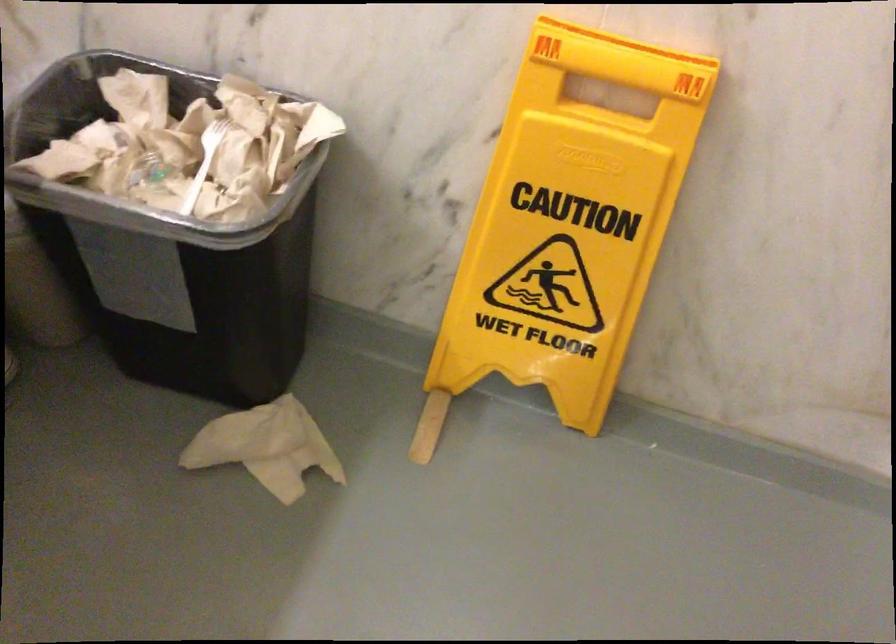
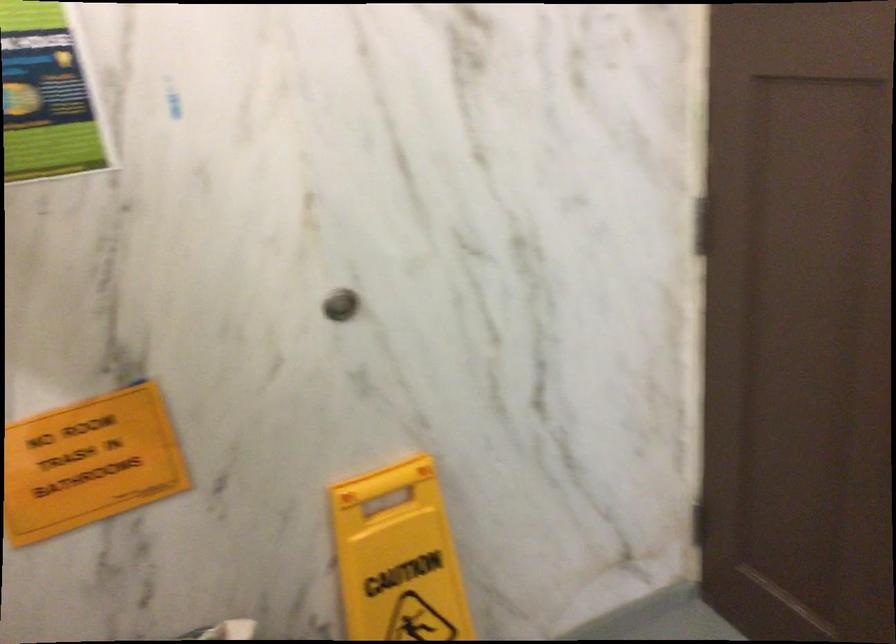
Question: Based on the continuous images, in which direction is the camera rotating? Reply with the corresponding letter.

Choices:
 (A) Left
 (B) Right
 (C) Up
 (D) Down

Answer: (B)